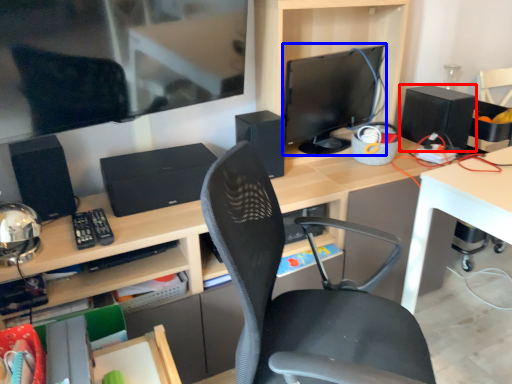
Question: Which of the following is the farthest to the observer, speaker (highlighted by a red box) or computer monitor (highlighted by a blue box)?

Choices:
 (A) speaker
 (B) computer monitor

Answer: (A)